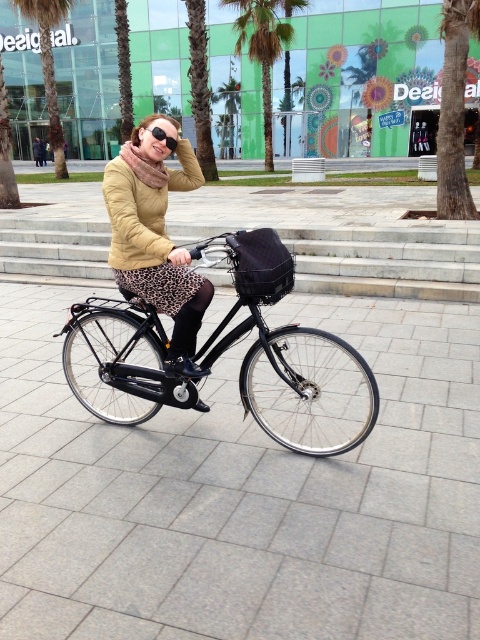
In the scene shown: You are a delivery person who needs to carry a package that is 1.2 meters wide. You have the shiny black bicycle at center and black matte goggles at upper center. Can you determine if the bicycle is wide enough to carry the package? Please explain your reasoning.

The shiny black bicycle at center might be wider than black matte goggles at upper center. However, since the exact width of the bicycle isn not provided, it is uncertain if it can carry a 1.2 meter wide package. Further measurement is needed.

You are a delivery person who needs to attach a GPS tracker to your shiny black bicycle at center. The GPS tracker requires a 1.5 meter distance from the black matte goggles at upper center to ensure a clear signal. Can your bicycle meet this requirement?

The shiny black bicycle at center is 1.60 meters away from the black matte goggles at upper center, which is more than the required 1.5 meters. Therefore, the GPS tracker can be attached to the bicycle and still maintain a clear signal.

You are a pedestrian standing on the sidewalk next to the palm trees. You see the shiny black bicycle at center and the black matte goggles at upper center. Which object is closer to your left side?

The black matte goggles at upper center are closer to your left side because the shiny black bicycle at center is positioned to the right of them.